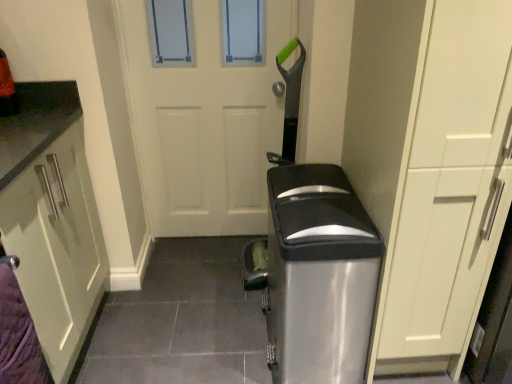
Question: From the image's perspective, is matte white cabinet at right located beneath white matte door at center?

Choices:
 (A) yes
 (B) no

Answer: (A)

Question: From the image's perspective, would you say matte white cabinet at right is positioned over white matte door at center?

Choices:
 (A) yes
 (B) no

Answer: (B)

Question: Is matte white cabinet at right to the right of white matte door at center from the viewer's perspective?

Choices:
 (A) no
 (B) yes

Answer: (B)

Question: From a real-world perspective, is matte white cabinet at right physically above white matte door at center?

Choices:
 (A) yes
 (B) no

Answer: (A)

Question: Is matte white cabinet at right not within white matte door at center?

Choices:
 (A) yes
 (B) no

Answer: (A)

Question: Relative to matte white cabinet at right, is satin silver trash can at center in front or behind?

Choices:
 (A) behind
 (B) front

Answer: (A)

Question: From the image's perspective, is satin silver trash can at center positioned above or below matte white cabinet at right?

Choices:
 (A) above
 (B) below

Answer: (B)

Question: Considering the positions of point (342, 349) and point (373, 13), is point (342, 349) closer or farther from the camera than point (373, 13)?

Choices:
 (A) closer
 (B) farther

Answer: (B)

Question: From a real-world perspective, is satin silver trash can at center positioned above or below matte white cabinet at right?

Choices:
 (A) above
 (B) below

Answer: (B)

Question: From the image's perspective, is matte white cabinet at left above or below white matte door at center?

Choices:
 (A) above
 (B) below

Answer: (B)

Question: Do you think matte white cabinet at left is within white matte door at center, or outside of it?

Choices:
 (A) outside
 (B) inside

Answer: (A)

Question: Is point (53, 369) closer or farther from the camera than point (179, 140)?

Choices:
 (A) farther
 (B) closer

Answer: (B)

Question: Relative to white matte door at center, is matte white cabinet at left in front or behind?

Choices:
 (A) front
 (B) behind

Answer: (A)

Question: Looking at the image, does white matte door at center seem bigger or smaller compared to matte white cabinet at left?

Choices:
 (A) big
 (B) small

Answer: (B)

Question: Considering the positions of point (225, 158) and point (31, 163), is point (225, 158) closer or farther from the camera than point (31, 163)?

Choices:
 (A) farther
 (B) closer

Answer: (A)